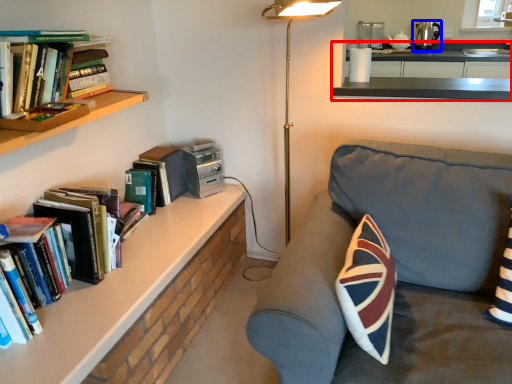
Question: Which of the following is the farthest to the observer, counter (highlighted by a red box) or appliance (highlighted by a blue box)?

Choices:
 (A) counter
 (B) appliance

Answer: (B)